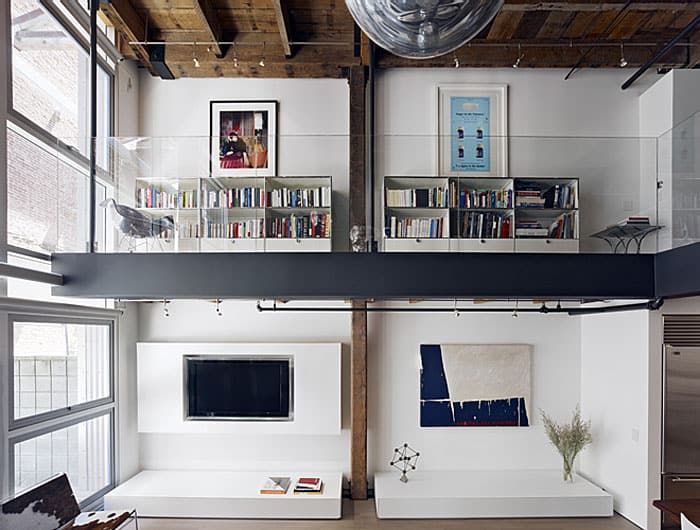
Where is `window`? The image size is (700, 530). window is located at coordinates (41, 163).